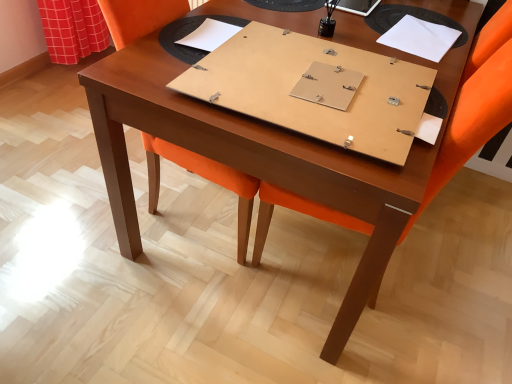
The width and height of the screenshot is (512, 384). I want to click on space that is in front of orange fabric swivel chair at center, so click(x=150, y=315).